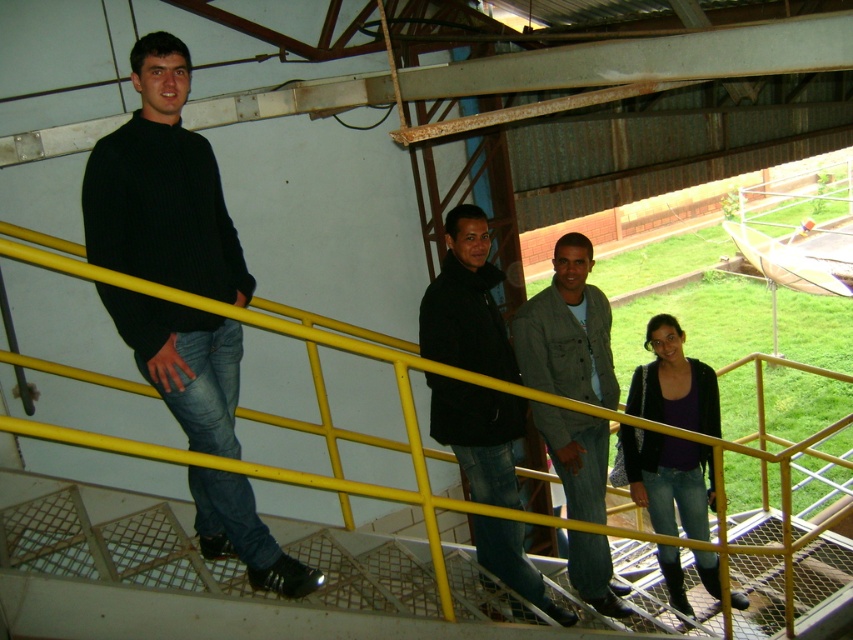
Question: Is black ribbed sweater at left bigger than denim jacket at center?

Choices:
 (A) yes
 (B) no

Answer: (B)

Question: Does yellow metal railing at upper left appear on the right side of denim jacket at center?

Choices:
 (A) yes
 (B) no

Answer: (B)

Question: Considering the real-world distances, which object is closest to the black matte jacket at center?

Choices:
 (A) yellow metal railing at upper left
 (B) denim jeans at lower right
 (C) denim jacket at center

Answer: (C)

Question: Which point is farther to the camera?

Choices:
 (A) denim jeans at lower right
 (B) yellow metal railing at upper left

Answer: (A)

Question: Which of the following is the closest to the observer?

Choices:
 (A) black ribbed sweater at left
 (B) denim jeans at lower right

Answer: (A)

Question: Does yellow metal railing at upper left appear on the right side of black ribbed sweater at left?

Choices:
 (A) no
 (B) yes

Answer: (B)